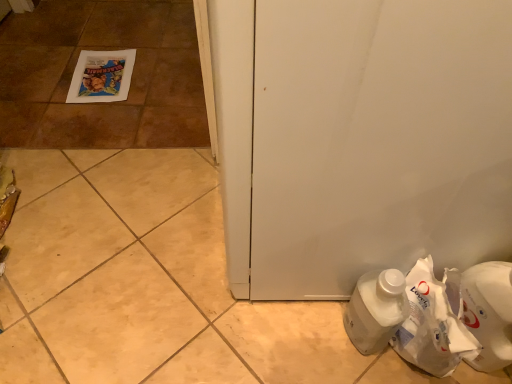
What is the approximate width of matte paper poster at upper left?

8.49 inches.

Where is `white matte door at center`? white matte door at center is located at coordinates (378, 140).

Describe the element at coordinates (376, 309) in the screenshot. I see `white plastic bottle at lower right` at that location.

At what (x,y) coordinates should I click in order to perform the action: click on matte paper poster at upper left. Please return your answer as a coordinate pair (x, y). Image resolution: width=512 pixels, height=384 pixels. Looking at the image, I should click on (141, 75).

Is matte paper poster at upper left aimed at white matte door at center?

No, matte paper poster at upper left is not turned towards white matte door at center.

From a real-world perspective, is matte paper poster at upper left physically above white matte door at center?

No.

How different are the orientations of matte paper poster at upper left and white matte door at center in degrees?

The facing directions of matte paper poster at upper left and white matte door at center are 4.24 degrees apart.

From the image's perspective, which is below, matte paper poster at upper left or white matte door at center?

From the image's view, white matte door at center is below.

Based on their sizes in the image, would you say white plastic bottle at lower right is bigger or smaller than white paper bag at lower right?

Clearly, white plastic bottle at lower right is smaller in size than white paper bag at lower right.

The height and width of the screenshot is (384, 512). I want to click on paper bag on the right of white plastic bottle at lower right, so click(432, 326).

Does point (379, 291) come in front of point (408, 321)?

Yes, point (379, 291) is in front of point (408, 321).

Is white plastic bottle at lower right situated inside matte paper poster at upper left or outside?

white plastic bottle at lower right is located beyond the bounds of matte paper poster at upper left.

What's the angular difference between white plastic bottle at lower right and matte paper poster at upper left's facing directions?

There is a 4.58-degree angle between the facing directions of white plastic bottle at lower right and matte paper poster at upper left.

Who is shorter, white plastic bottle at lower right or matte paper poster at upper left?

Standing shorter between the two is matte paper poster at upper left.

From the image's perspective, which one is positioned lower, white plastic bottle at lower right or matte paper poster at upper left?

From the image's view, white plastic bottle at lower right is below.

Is white matte door at center positioned behind white plastic bottle at lower right?

No, it is not.

From the image's perspective, between white matte door at center and white plastic bottle at lower right, which one is located above?

white matte door at center is shown above in the image.

Is white matte door at center wider than white plastic bottle at lower right?

Yes.

Does white paper bag at lower right have a lesser width compared to white matte door at center?

Yes.

Considering the sizes of white paper bag at lower right and white matte door at center in the image, is white paper bag at lower right bigger or smaller than white matte door at center?

In the image, white paper bag at lower right appears to be smaller than white matte door at center.

Considering the positions of point (475, 339) and point (276, 266), is point (475, 339) closer or farther from the camera than point (276, 266)?

Point (475, 339) appears to be closer to the viewer than point (276, 266).

Is white paper bag at lower right wider or thinner than white plastic bottle at lower right?

Considering their sizes, white paper bag at lower right looks broader than white plastic bottle at lower right.

Are white paper bag at lower right and white plastic bottle at lower right located far from each other?

No, there isn't a large distance between white paper bag at lower right and white plastic bottle at lower right.

From a real-world perspective, is white paper bag at lower right on top of white plastic bottle at lower right?

Actually, white paper bag at lower right is physically below white plastic bottle at lower right in the real world.

Is point (361, 297) closer or farther from the camera than point (326, 131)?

Clearly, point (361, 297) is more distant from the camera than point (326, 131).

Is white plastic bottle at lower right shorter than white matte door at center?

Indeed, white plastic bottle at lower right has a lesser height compared to white matte door at center.

How much distance is there between white plastic bottle at lower right and white matte door at center?

white plastic bottle at lower right is 9.39 inches from white matte door at center.

Does white plastic bottle at lower right have a larger size compared to white matte door at center?

No.

Locate an element on the screen. tile that is above the white matte door at center (from the image's perspective) is located at coordinates (141, 75).

The width and height of the screenshot is (512, 384). I want to click on paper bag located in front of the white plastic bottle at lower right, so click(x=432, y=326).

From the image, which object appears to be nearer to white plastic bottle at lower right, matte paper poster at upper left or white paper bag at lower right?

white paper bag at lower right is closer to white plastic bottle at lower right.

Looking at the image, which one is located closer to white matte door at center, matte paper poster at upper left or white plastic bottle at lower right?

Based on the image, white plastic bottle at lower right appears to be nearer to white matte door at center.

Considering their positions, is matte paper poster at upper left positioned closer to white plastic bottle at lower right than white matte door at center?

white matte door at center.

Looking at the image, which one is located closer to white matte door at center, white paper bag at lower right or matte paper poster at upper left?

Based on the image, white paper bag at lower right appears to be nearer to white matte door at center.

From the picture: Considering their positions, is white plastic bottle at lower right positioned further to matte paper poster at upper left than white matte door at center?

Among the two, white matte door at center is located further to matte paper poster at upper left.

Based on their spatial positions, is white paper bag at lower right or white plastic bottle at lower right closer to matte paper poster at upper left?

The object closer to matte paper poster at upper left is white plastic bottle at lower right.

Based on the photo, which object lies further to the anchor point white paper bag at lower right, white plastic bottle at lower right or white matte door at center?

white matte door at center is further to white paper bag at lower right.

Which object lies further to the anchor point matte paper poster at upper left, white matte door at center or white paper bag at lower right?

white paper bag at lower right lies further to matte paper poster at upper left than the other object.

Where is `bottle situated between matte paper poster at upper left and white paper bag at lower right from left to right`? The width and height of the screenshot is (512, 384). bottle situated between matte paper poster at upper left and white paper bag at lower right from left to right is located at coordinates (376, 309).

Locate an element on the screen. paper bag between white matte door at center and matte paper poster at upper left in the front-back direction is located at coordinates (432, 326).

Locate an element on the screen. bottle that lies between white matte door at center and white paper bag at lower right from top to bottom is located at coordinates (376, 309).

Find the location of `bottle located between white matte door at center and matte paper poster at upper left in the depth direction`. bottle located between white matte door at center and matte paper poster at upper left in the depth direction is located at coordinates (376, 309).